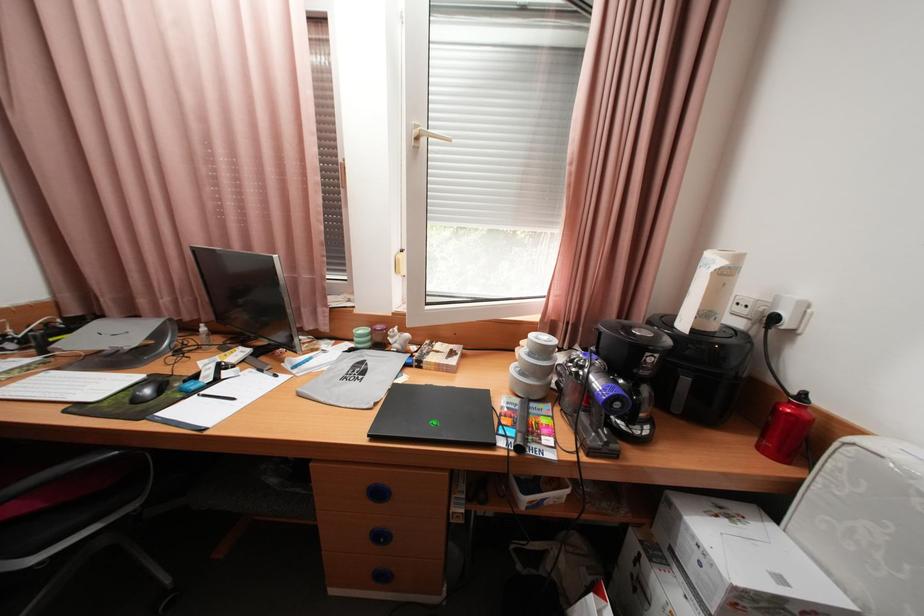
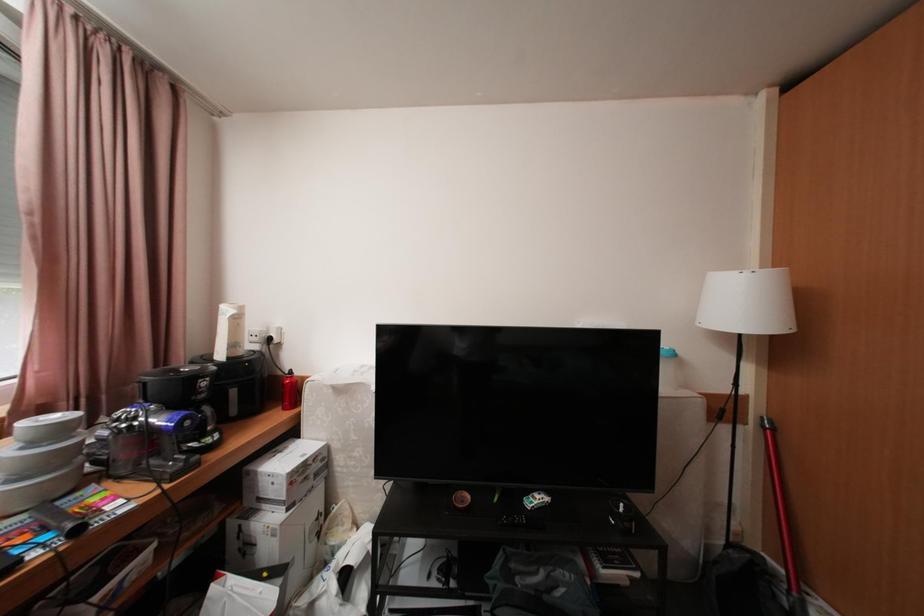
Question: The camera is either moving clockwise (left) or counter-clockwise (right) around the object. The first image is from the beginning of the video and the second image is from the end. Is the camera moving left or right when shooting the video?

Choices:
 (A) Left
 (B) Right

Answer: (A)